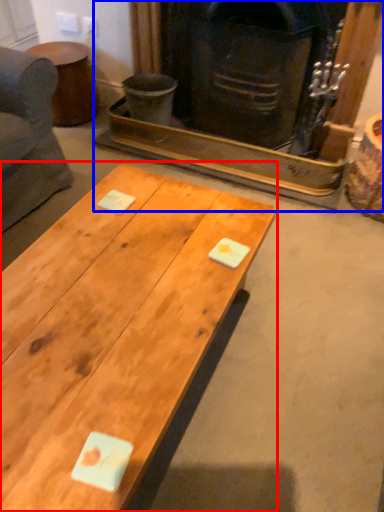
Question: Among these objects, which one is farthest to the camera, coffee table (highlighted by a red box) or fireplace (highlighted by a blue box)?

Choices:
 (A) coffee table
 (B) fireplace

Answer: (B)